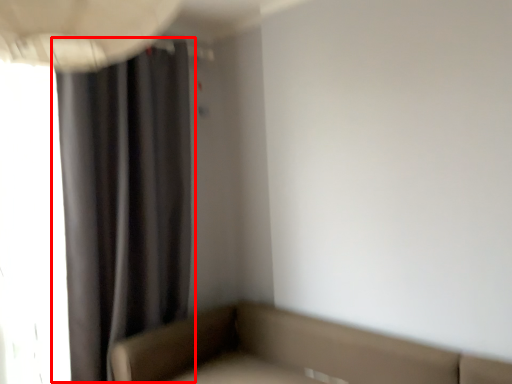
Question: From the image, what is the correct spatial relationship of curtain (annotated by the red box) in relation to studio couch?

Choices:
 (A) left
 (B) right

Answer: (A)